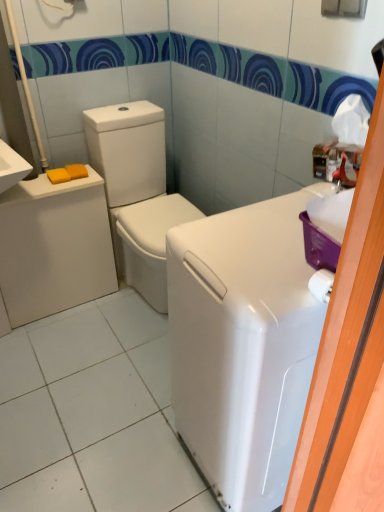
Question: Considering the relative sizes of white glossy washing machine at right and white glossy washer at center in the image provided, is white glossy washing machine at right taller than white glossy washer at center?

Choices:
 (A) no
 (B) yes

Answer: (B)

Question: Is white glossy washing machine at right to the left of white glossy washer at center from the viewer's perspective?

Choices:
 (A) no
 (B) yes

Answer: (A)

Question: Could you tell me if white glossy washing machine at right is facing white glossy washer at center?

Choices:
 (A) no
 (B) yes

Answer: (A)

Question: Can you confirm if white glossy washing machine at right is smaller than white glossy washer at center?

Choices:
 (A) no
 (B) yes

Answer: (B)

Question: Is white glossy washing machine at right surrounding white glossy washer at center?

Choices:
 (A) yes
 (B) no

Answer: (B)

Question: In terms of width, does matte white porcelain at left look wider or thinner when compared to yellow matte soap at left, placed as the 1th soap when sorted from right to left?

Choices:
 (A) wide
 (B) thin

Answer: (A)

Question: Considering the positions of matte white porcelain at left and yellow matte soap at left, which is counted as the 2th soap, starting from the left, in the image, is matte white porcelain at left taller or shorter than yellow matte soap at left, which is counted as the 2th soap, starting from the left,?

Choices:
 (A) tall
 (B) short

Answer: (A)

Question: Is matte white porcelain at left bigger or smaller than yellow matte soap at left, which is counted as the 2th soap, starting from the left?

Choices:
 (A) small
 (B) big

Answer: (B)

Question: Relative to yellow matte soap at left, placed as the 1th soap when sorted from right to left, is matte white porcelain at left in front or behind?

Choices:
 (A) front
 (B) behind

Answer: (A)

Question: Relative to yellow matte soap at left, which is counted as the 2th soap, starting from the left, is yellow matte soap at left, positioned as the second soap in right-to-left order, in front or behind?

Choices:
 (A) behind
 (B) front

Answer: (B)

Question: Looking at the image, does yellow matte soap at left, positioned as the second soap in right-to-left order, seem bigger or smaller compared to yellow matte soap at left, placed as the 1th soap when sorted from right to left?

Choices:
 (A) small
 (B) big

Answer: (A)

Question: Is yellow matte soap at left, positioned as the second soap in right-to-left order, to the left or to the right of yellow matte soap at left, placed as the 1th soap when sorted from right to left, in the image?

Choices:
 (A) left
 (B) right

Answer: (A)

Question: From the image's perspective, is yellow matte soap at left, positioned as the second soap in right-to-left order, positioned above or below yellow matte soap at left, placed as the 1th soap when sorted from right to left?

Choices:
 (A) below
 (B) above

Answer: (A)

Question: Is yellow matte soap at left, which is counted as the 2th soap, starting from the left, taller or shorter than white glossy washing machine at right?

Choices:
 (A) tall
 (B) short

Answer: (B)

Question: Considering their positions, is yellow matte soap at left, which is counted as the 2th soap, starting from the left, located in front of or behind white glossy washing machine at right?

Choices:
 (A) front
 (B) behind

Answer: (B)